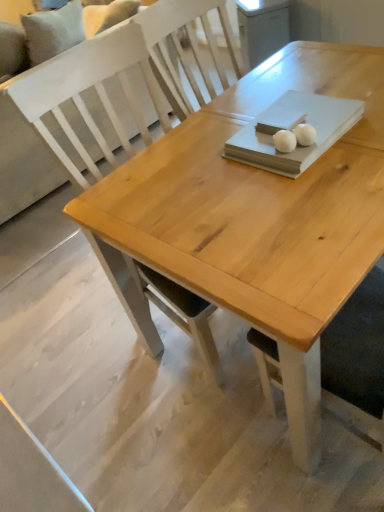
Question: In terms of size, does white matte ball at center, which is the 1th food in left-to-right order, appear bigger or smaller than natural wood table at center?

Choices:
 (A) big
 (B) small

Answer: (B)

Question: Which is correct: white matte ball at center, which is the 1th food in left-to-right order, is inside natural wood table at center, or outside of it?

Choices:
 (A) inside
 (B) outside

Answer: (B)

Question: Which is nearer to the white matte ball at center, the second food viewed from the right?

Choices:
 (A) white glossy egg at upper center, arranged as the 1th food when viewed from the right
 (B) white fabric couch at upper left
 (C) natural wood table at center

Answer: (A)

Question: Which of these objects is positioned closest to the white fabric couch at upper left?

Choices:
 (A) white glossy egg at upper center, arranged as the second food when viewed from the left
 (B) white matte ball at center, which is the 1th food in left-to-right order
 (C) natural wood table at center

Answer: (C)